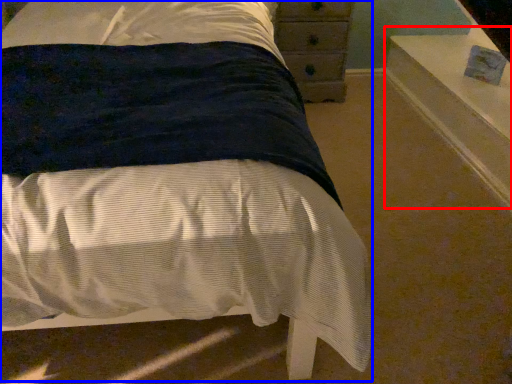
Question: Which of the following is the farthest to the observer, window sill (highlighted by a red box) or bed (highlighted by a blue box)?

Choices:
 (A) window sill
 (B) bed

Answer: (A)